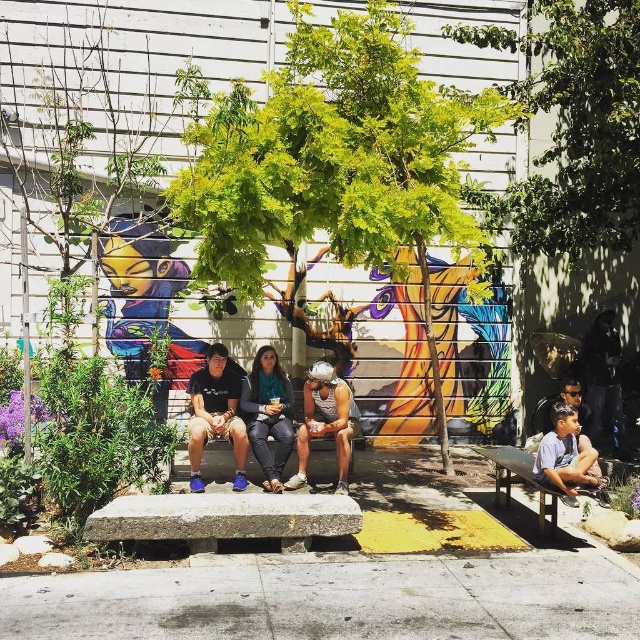
From the picture: Does concrete bench at center appear under wooden bench at lower right?

No, concrete bench at center is not below wooden bench at lower right.

Can you confirm if concrete bench at center is positioned above wooden bench at lower right?

Yes, concrete bench at center is above wooden bench at lower right.

I want to click on concrete bench at center, so click(218, 460).

Does point (145, 538) come behind point (512, 474)?

That is False.

Between point (250, 529) and point (548, 513), which one is positioned behind?

Positioned behind is point (548, 513).

Does point (323, 529) come behind point (509, 472)?

That is False.

Image resolution: width=640 pixels, height=640 pixels. Find the location of `gray concrete bench at center`. gray concrete bench at center is located at coordinates (225, 518).

From the picture: Who is lower down, dark blue jeans at center or light blue denim shorts at lower right?

light blue denim shorts at lower right is below.

Can you confirm if dark blue jeans at center is shorter than light blue denim shorts at lower right?

Incorrect, dark blue jeans at center's height does not fall short of light blue denim shorts at lower right's.

Is point (275, 376) behind point (576, 470)?

Yes, point (275, 376) is farther from viewer.

You are a GUI agent. You are given a task and a screenshot of the screen. Output one action in this format:
    pyautogui.click(x=<x>, y=<y>)
    Task: Click on the dark blue jeans at center
    This screenshot has width=640, height=640.
    Given the screenshot: What is the action you would take?
    pyautogui.click(x=268, y=413)